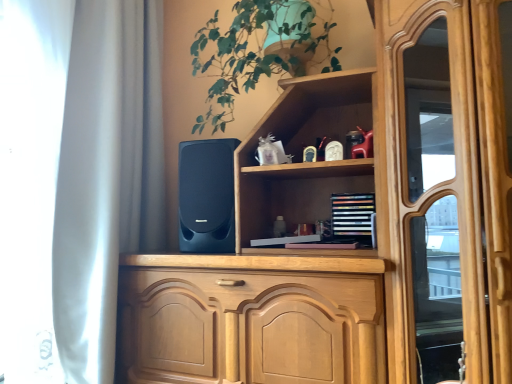
Find the location of a particular element. Image resolution: width=512 pixels, height=384 pixels. multicolored wooden bookshelf at upper center is located at coordinates pos(354,217).

In order to click on white matte curtain at left in this screenshot , I will do `click(106, 175)`.

From the image's perspective, is multicolored wooden bookshelf at upper center below green leafy plant at upper center?

Yes.

Can you confirm if multicolored wooden bookshelf at upper center is positioned to the left of green leafy plant at upper center?

No, multicolored wooden bookshelf at upper center is not to the left of green leafy plant at upper center.

Measure the distance from multicolored wooden bookshelf at upper center to green leafy plant at upper center.

A distance of 21.94 inches exists between multicolored wooden bookshelf at upper center and green leafy plant at upper center.

This screenshot has width=512, height=384. Find the location of `book that is on the right side of green leafy plant at upper center`. book that is on the right side of green leafy plant at upper center is located at coordinates (354, 217).

How different are the orientations of white matte curtain at left and green leafy plant at upper center in degrees?

white matte curtain at left and green leafy plant at upper center are facing 90 degrees away from each other.

Is green leafy plant at upper center located within white matte curtain at left?

Actually, green leafy plant at upper center is outside white matte curtain at left.

Where is `plant that is above the white matte curtain at left (from the image's perspective)`? The image size is (512, 384). plant that is above the white matte curtain at left (from the image's perspective) is located at coordinates (256, 52).

Is green leafy plant at upper center at the back of white matte curtain at left?

Yes, green leafy plant at upper center is at the back of white matte curtain at left.

Which is in front, point (93, 340) or point (195, 148)?

The point (93, 340) is more forward.

Locate an element on the screen. curtain above the matte black speaker at center (from a real-world perspective) is located at coordinates (106, 175).

Consider the image. Which is more to the right, white matte curtain at left or matte black speaker at center?

From the viewer's perspective, matte black speaker at center appears more on the right side.

Is white matte curtain at left facing towards matte black speaker at center?

Yes, white matte curtain at left is facing matte black speaker at center.

Which point is more forward, [154,2] or [341,237]?

The point [341,237] is closer.

Is white matte curtain at left taller than multicolored wooden bookshelf at upper center?

Yes, white matte curtain at left is taller than multicolored wooden bookshelf at upper center.

Is white matte curtain at left oriented towards multicolored wooden bookshelf at upper center?

Yes, white matte curtain at left faces towards multicolored wooden bookshelf at upper center.

Can you confirm if matte black speaker at center is wider than multicolored wooden bookshelf at upper center?

Yes.

Can you confirm if matte black speaker at center is taller than multicolored wooden bookshelf at upper center?

Yes.

From a real-world perspective, is matte black speaker at center located beneath multicolored wooden bookshelf at upper center?

Incorrect, from a real-world perspective, matte black speaker at center is higher than multicolored wooden bookshelf at upper center.

Is multicolored wooden bookshelf at upper center located within matte black speaker at center?

No, multicolored wooden bookshelf at upper center is located outside of matte black speaker at center.

How far apart are matte black speaker at center and green leafy plant at upper center?

matte black speaker at center and green leafy plant at upper center are 11.33 inches apart from each other.

Is matte black speaker at center looking in the opposite direction of green leafy plant at upper center?

No, green leafy plant at upper center is not at the back of matte black speaker at center.

Does matte black speaker at center have a greater width compared to green leafy plant at upper center?

No.

Is matte black speaker at center in front of or behind green leafy plant at upper center in the image?

Clearly, matte black speaker at center is behind green leafy plant at upper center.

Is point (234, 94) closer or farther from the camera than point (103, 199)?

Point (234, 94).

Is white matte curtain at left at the back of green leafy plant at upper center?

No.

In terms of height, does green leafy plant at upper center look taller or shorter compared to white matte curtain at left?

green leafy plant at upper center is shorter than white matte curtain at left.

The height and width of the screenshot is (384, 512). I want to click on book below the green leafy plant at upper center (from the image's perspective), so click(x=354, y=217).

I want to click on plant located on the right of white matte curtain at left, so click(x=256, y=52).

Estimate the real-world distances between objects in this image. Which object is further from white matte curtain at left, multicolored wooden bookshelf at upper center or matte black speaker at center?

Among the two, multicolored wooden bookshelf at upper center is located further to white matte curtain at left.

When comparing their distances from green leafy plant at upper center, does white matte curtain at left or matte black speaker at center seem closer?

matte black speaker at center is closer to green leafy plant at upper center.

When comparing their distances from white matte curtain at left, does matte black speaker at center or multicolored wooden bookshelf at upper center seem further?

Based on the image, multicolored wooden bookshelf at upper center appears to be further to white matte curtain at left.

Estimate the real-world distances between objects in this image. Which object is further from green leafy plant at upper center, white matte curtain at left or multicolored wooden bookshelf at upper center?

Among the two, multicolored wooden bookshelf at upper center is located further to green leafy plant at upper center.

When comparing their distances from matte black speaker at center, does green leafy plant at upper center or white matte curtain at left seem further?

white matte curtain at left lies further to matte black speaker at center than the other object.

When comparing their distances from green leafy plant at upper center, does multicolored wooden bookshelf at upper center or matte black speaker at center seem further?

Based on the image, multicolored wooden bookshelf at upper center appears to be further to green leafy plant at upper center.

When comparing their distances from multicolored wooden bookshelf at upper center, does matte black speaker at center or green leafy plant at upper center seem closer?

Based on the image, matte black speaker at center appears to be nearer to multicolored wooden bookshelf at upper center.

Looking at the image, which one is located closer to white matte curtain at left, green leafy plant at upper center or multicolored wooden bookshelf at upper center?

Among the two, green leafy plant at upper center is located nearer to white matte curtain at left.

You are a GUI agent. You are given a task and a screenshot of the screen. Output one action in this format:
    pyautogui.click(x=<x>, y=<y>)
    Task: Click on the speaker between white matte curtain at left and multicolored wooden bookshelf at upper center from left to right
    
    Given the screenshot: What is the action you would take?
    pyautogui.click(x=206, y=196)

Find the location of a particular element. speaker between white matte curtain at left and green leafy plant at upper center in the horizontal direction is located at coordinates (206, 196).

The height and width of the screenshot is (384, 512). Identify the location of speaker between green leafy plant at upper center and multicolored wooden bookshelf at upper center in the vertical direction. (206, 196).

You are a GUI agent. You are given a task and a screenshot of the screen. Output one action in this format:
    pyautogui.click(x=<x>, y=<y>)
    Task: Click on the plant between white matte curtain at left and multicolored wooden bookshelf at upper center from left to right
    The image size is (512, 384).
    Given the screenshot: What is the action you would take?
    pyautogui.click(x=256, y=52)